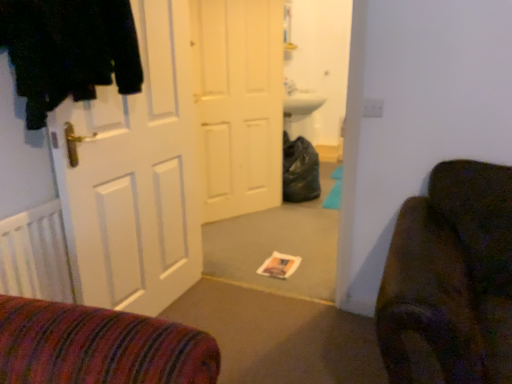
The image size is (512, 384). Identify the location of free point below white matte door at center, which is the second door in front-to-back order (from a real-world perspective). (239, 212).